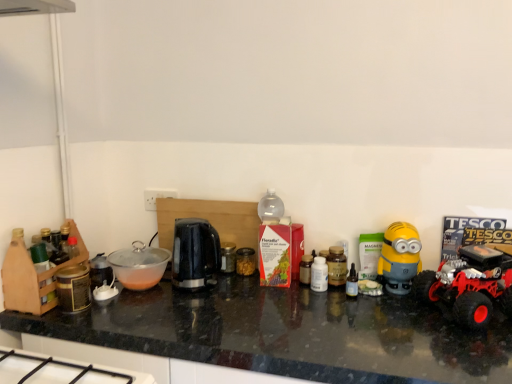
The height and width of the screenshot is (384, 512). I want to click on translucent plastic jar at center, acting as the 2th toy starting from the right, so pos(245,261).

This screenshot has width=512, height=384. Identify the location of transparent plastic bowl at center. (139, 265).

Find the location of a particular element. translucent plastic bottle at center, placed as the fourth bottle when sorted from left to right is located at coordinates (352, 283).

Is metallic black kettle at center taller than white plastic bottle at center, marked as the second bottle in a left-to-right arrangement?

In fact, metallic black kettle at center may be shorter than white plastic bottle at center, marked as the second bottle in a left-to-right arrangement.

From the image's perspective, is metallic black kettle at center on white plastic bottle at center, marked as the second bottle in a left-to-right arrangement?

Yes, from the image's perspective, metallic black kettle at center is over white plastic bottle at center, marked as the second bottle in a left-to-right arrangement.

Does point (233, 250) lie in front of point (319, 283)?

No.

Which object is closer to the camera, metallic black kettle at center or white plastic bottle at center, marked as the third bottle in a right-to-left arrangement?

white plastic bottle at center, marked as the third bottle in a right-to-left arrangement, is in front.

Is black granite countertop at center in front of or behind brown glass bottle at center, the 3th bottle when ordered from left to right, in the image?

Clearly, black granite countertop at center is in front of brown glass bottle at center, the 3th bottle when ordered from left to right.

Considering the sizes of black granite countertop at center and brown glass bottle at center, which is the 2th bottle from right to left, in the image, is black granite countertop at center wider or thinner than brown glass bottle at center, which is the 2th bottle from right to left,?

In the image, black granite countertop at center appears to be wider than brown glass bottle at center, which is the 2th bottle from right to left.

Based on their positions, is white plastic bottle at center, marked as the second bottle in a left-to-right arrangement, located to the left or right of black granite countertop at center?

white plastic bottle at center, marked as the second bottle in a left-to-right arrangement, is to the right of black granite countertop at center.

Is white plastic bottle at center, marked as the second bottle in a left-to-right arrangement, not inside black granite countertop at center?

Yes, white plastic bottle at center, marked as the second bottle in a left-to-right arrangement, is outside of black granite countertop at center.

Is white plastic bottle at center, marked as the third bottle in a right-to-left arrangement, facing away from black granite countertop at center?

No, black granite countertop at center is not at the back of white plastic bottle at center, marked as the third bottle in a right-to-left arrangement.

Based on the photo, is white plastic bottle at center, marked as the third bottle in a right-to-left arrangement, in front of or behind black granite countertop at center in the image?

white plastic bottle at center, marked as the third bottle in a right-to-left arrangement, is positioned farther from the viewer than black granite countertop at center.

Is translucent plastic bottle at center, which appears as the first bottle when viewed from the left, at the back of transparent plastic bowl at center?

That's not correct — transparent plastic bowl at center is not looking away from translucent plastic bottle at center, which appears as the first bottle when viewed from the left.

Between transparent plastic bowl at center and translucent plastic bottle at center, which appears as the first bottle when viewed from the left, which one has larger width?

With larger width is transparent plastic bowl at center.

Considering the relative sizes of transparent plastic bowl at center and translucent plastic bottle at center, the fourth bottle positioned from the right, in the image provided, is transparent plastic bowl at center shorter than translucent plastic bottle at center, the fourth bottle positioned from the right,?

Yes, transparent plastic bowl at center is shorter than translucent plastic bottle at center, the fourth bottle positioned from the right.

Consider the image. Who is smaller, transparent plastic bowl at center or translucent plastic bottle at center, which appears as the first bottle when viewed from the left?

translucent plastic bottle at center, which appears as the first bottle when viewed from the left, is smaller.

Which object is positioned more to the right, yellow matte minion toy at right, which appears as the 2th toy when viewed from the back, or black granite countertop at center?

yellow matte minion toy at right, which appears as the 2th toy when viewed from the back, is more to the right.

Is point (406, 253) positioned in front of point (501, 339)?

That is False.

Can black granite countertop at center be found inside yellow matte minion toy at right, which ranks as the first toy in front-to-back order?

That's incorrect, black granite countertop at center is not inside yellow matte minion toy at right, which ranks as the first toy in front-to-back order.

Considering the sizes of objects yellow matte minion toy at right, which ranks as the first toy in front-to-back order, and black granite countertop at center in the image provided, who is smaller, yellow matte minion toy at right, which ranks as the first toy in front-to-back order, or black granite countertop at center?

yellow matte minion toy at right, which ranks as the first toy in front-to-back order, is smaller.

Does metallic black kettle at center have a lesser height compared to translucent plastic bottle at center, which appears as the first bottle when viewed from the left?

Yes, metallic black kettle at center is shorter than translucent plastic bottle at center, which appears as the first bottle when viewed from the left.

Which is in front, point (227, 263) or point (303, 263)?

The point (303, 263) is more forward.

Is metallic black kettle at center to the left of translucent plastic bottle at center, which appears as the first bottle when viewed from the left, from the viewer's perspective?

Yes, metallic black kettle at center is to the left of translucent plastic bottle at center, which appears as the first bottle when viewed from the left.

Between metallic black kettle at center and translucent plastic bottle at center, the fourth bottle positioned from the right, which one has smaller width?

translucent plastic bottle at center, the fourth bottle positioned from the right.

Is translucent plastic jar at center, the 1th toy in the left-to-right sequence, positioned with its back to black plastic kettle at center?

No, translucent plastic jar at center, the 1th toy in the left-to-right sequence, is not facing the opposite direction of black plastic kettle at center.

From a real-world perspective, does translucent plastic jar at center, acting as the 2th toy starting from the right, stand above black plastic kettle at center?

Actually, translucent plastic jar at center, acting as the 2th toy starting from the right, is physically below black plastic kettle at center in the real world.

Considering the relative sizes of translucent plastic jar at center, the 1th toy in the left-to-right sequence, and black plastic kettle at center in the image provided, is translucent plastic jar at center, the 1th toy in the left-to-right sequence, bigger than black plastic kettle at center?

No, translucent plastic jar at center, the 1th toy in the left-to-right sequence, is not bigger than black plastic kettle at center.

Considering the sizes of objects translucent plastic jar at center, positioned as the 1th toy in back-to-front order, and black plastic kettle at center in the image provided, who is wider, translucent plastic jar at center, positioned as the 1th toy in back-to-front order, or black plastic kettle at center?

Wider between the two is black plastic kettle at center.

The image size is (512, 384). I want to click on appliance below the white plastic bottle at center, marked as the second bottle in a left-to-right arrangement (from a real-world perspective), so click(228, 257).

Starting from the black granite countertop at center, which bottle is the 3rd one to the right? Please provide its 2D coordinates.

[(337, 266)]

Considering their positions, is red rubber toy truck at right positioned closer to translucent plastic bottle at center, the fourth bottle positioned from the right, than brown glass bottle at center, the 3th bottle when ordered from left to right?

The object closer to translucent plastic bottle at center, the fourth bottle positioned from the right, is brown glass bottle at center, the 3th bottle when ordered from left to right.

From the image, which object appears to be nearer to translucent plastic jar at center, the 2th toy viewed from the front, black granite countertop at center or black plastic kettle at center?

black plastic kettle at center.

Based on their spatial positions, is black granite countertop at center or translucent plastic bottle at center, which is counted as the 1th bottle, starting from the right, closer to yellow matte minion toy at right, positioned as the 1th toy in right-to-left order?

Based on the image, translucent plastic bottle at center, which is counted as the 1th bottle, starting from the right, appears to be nearer to yellow matte minion toy at right, positioned as the 1th toy in right-to-left order.

From the image, which object appears to be nearer to brown glass bottle at center, the 3th bottle when ordered from left to right, white plastic bottle at center, marked as the second bottle in a left-to-right arrangement, or translucent plastic bottle at center, which appears as the first bottle when viewed from the left?

white plastic bottle at center, marked as the second bottle in a left-to-right arrangement.

Looking at the image, which one is located closer to metallic black kettle at center, black granite countertop at center or translucent plastic bottle at center, which is counted as the 1th bottle, starting from the right?

Among the two, translucent plastic bottle at center, which is counted as the 1th bottle, starting from the right, is located nearer to metallic black kettle at center.

Looking at the image, which one is located closer to red rubber toy truck at right, transparent plastic bowl at center or translucent plastic bottle at center, which is counted as the 1th bottle, starting from the right?

Among the two, translucent plastic bottle at center, which is counted as the 1th bottle, starting from the right, is located nearer to red rubber toy truck at right.

When comparing their distances from translucent plastic bottle at center, placed as the fourth bottle when sorted from left to right, does metallic black kettle at center or white plastic bottle at center, marked as the second bottle in a left-to-right arrangement, seem closer?

Among the two, white plastic bottle at center, marked as the second bottle in a left-to-right arrangement, is located nearer to translucent plastic bottle at center, placed as the fourth bottle when sorted from left to right.

Estimate the real-world distances between objects in this image. Which object is closer to white plastic bottle at center, marked as the second bottle in a left-to-right arrangement, translucent plastic bottle at center, which is counted as the 1th bottle, starting from the right, or red rubber toy truck at right?

translucent plastic bottle at center, which is counted as the 1th bottle, starting from the right, is closer to white plastic bottle at center, marked as the second bottle in a left-to-right arrangement.

Where is `coffee machine between transparent plastic bowl at center and white plastic bottle at center, marked as the second bottle in a left-to-right arrangement, from left to right`? coffee machine between transparent plastic bowl at center and white plastic bottle at center, marked as the second bottle in a left-to-right arrangement, from left to right is located at coordinates (195, 253).

Locate an element on the screen. bowl located between black granite countertop at center and metallic black kettle at center in the depth direction is located at coordinates (139, 265).

Locate an element on the screen. This screenshot has width=512, height=384. coffee machine between black granite countertop at center and transparent plastic bowl at center along the z-axis is located at coordinates (195, 253).

In order to click on toy between brown glass bottle at center, which is the 2th bottle from right to left, and red rubber toy truck at right from left to right in this screenshot , I will do `click(400, 257)`.